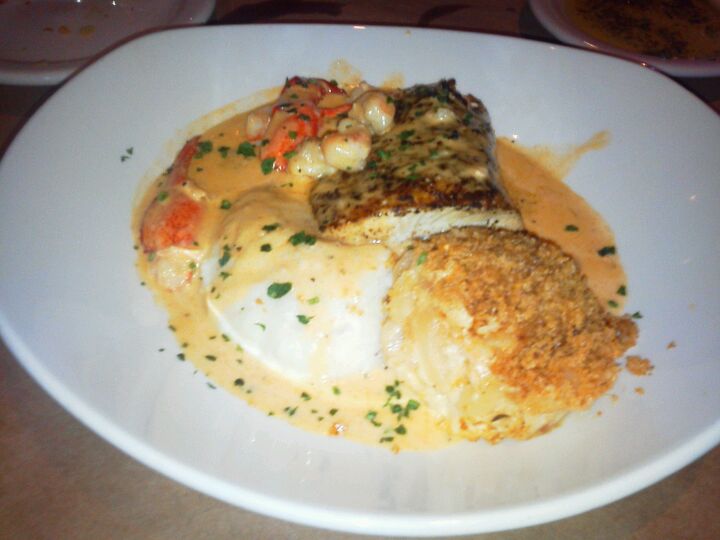
Identify the location of chicken on plate. The height and width of the screenshot is (540, 720). (418, 157).